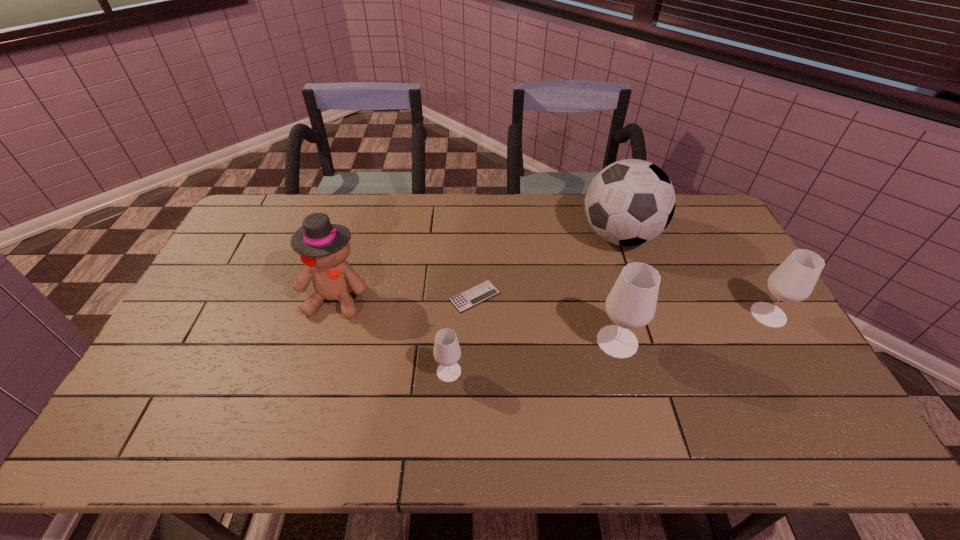
In the image, there is a desktop. Where is `vacant space at the near edge`? The height and width of the screenshot is (540, 960). vacant space at the near edge is located at coordinates (449, 395).

The image size is (960, 540). In order to click on vacant area at the left edge in this screenshot , I will do `click(204, 339)`.

Image resolution: width=960 pixels, height=540 pixels. Identify the location of free spot at the right edge of the desktop. (730, 248).

Find the location of a particular element. Image resolution: width=960 pixels, height=540 pixels. vacant space at the far left corner of the desktop is located at coordinates (258, 213).

In the image, there is a desktop. At what (x,y) coordinates should I click in order to perform the action: click on vacant space at the near right corner. Please return your answer as a coordinate pair (x, y). Image resolution: width=960 pixels, height=540 pixels. Looking at the image, I should click on (801, 399).

The height and width of the screenshot is (540, 960). In order to click on vacant space in between the fourth tallest object and the rag_doll in this screenshot , I will do `click(553, 306)`.

The height and width of the screenshot is (540, 960). What are the coordinates of `vacant space in between the second glass from right to left and the shortest object` in the screenshot? It's located at (546, 319).

You are a GUI agent. You are given a task and a screenshot of the screen. Output one action in this format:
    pyautogui.click(x=<x>, y=<y>)
    Task: Click on the empty location between the second glass from right to left and the leftmost object
    
    Given the screenshot: What is the action you would take?
    pyautogui.click(x=477, y=319)

The height and width of the screenshot is (540, 960). I want to click on empty space that is in between the shortest object and the soccer ball, so click(547, 266).

Identify the location of free point between the rightmost object and the soccer ball. (694, 275).